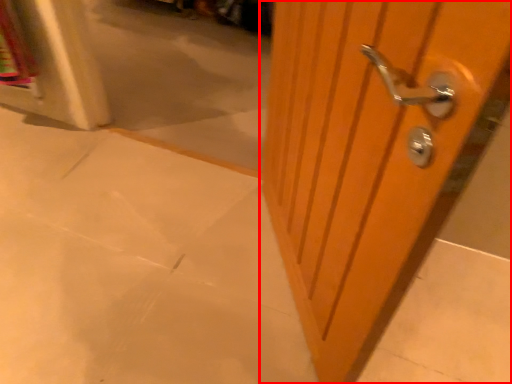
Question: From the image's perspective, where is door (annotated by the red box) located in relation to concrete in the image?

Choices:
 (A) above
 (B) below

Answer: (A)